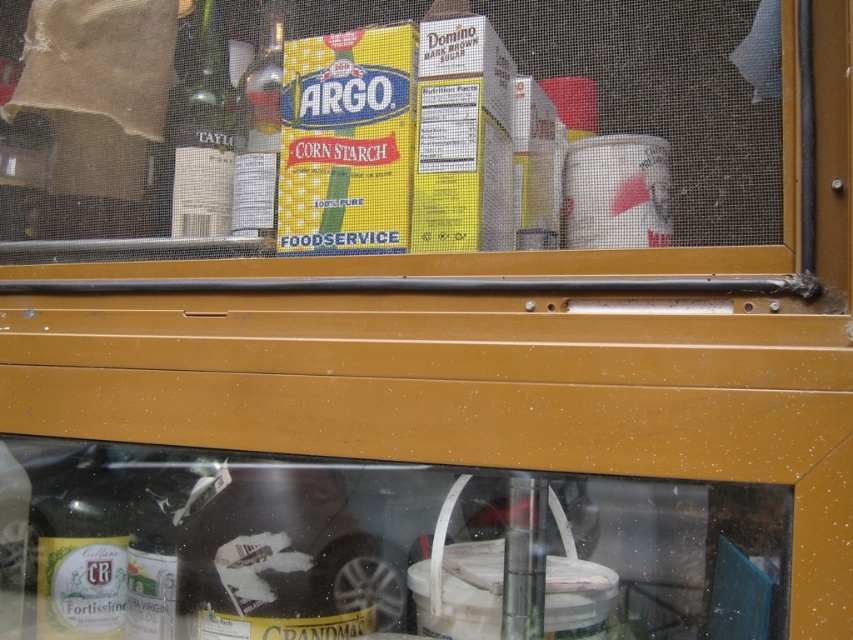
You are a delivery person looking through the window and see the yellow cardboard box at center and the green glass bottle at left. Which item is located to the right of the other?

The yellow cardboard box at center is positioned on the right side of green glass bottle at left, so the yellow cardboard box at center is to the right of the green glass bottle at left.

You are a delivery person trying to place a new bottle of olive oil between the green glass bottle at left and the metallic silver bottle at upper left. Can you fit it there?

The green glass bottle at left is closer to you than the metallic silver bottle at upper left, so there might be space between them to place the new bottle of olive oil.